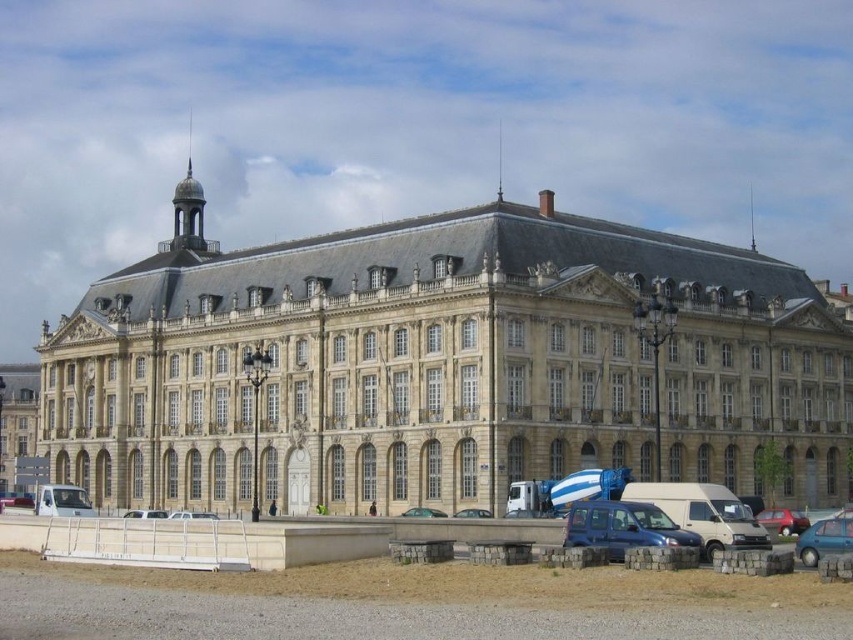
Question: Which point is farther to the camera?

Choices:
 (A) metallic blue hatchback at lower right
 (B) white matte van at lower left
 (C) white matte van at center
 (D) metallic blue car at center

Answer: (B)

Question: Is metallic blue van at lower center wider than metallic blue car at center?

Choices:
 (A) no
 (B) yes

Answer: (A)

Question: Which of the following is the closest to the observer?

Choices:
 (A) (158, 515)
 (B) (0, 493)

Answer: (A)

Question: Can you confirm if metallic blue van at lower center is thinner than matte black car at center?

Choices:
 (A) yes
 (B) no

Answer: (A)

Question: Observing the image, what is the correct spatial positioning of beige stone building at center in reference to metallic blue van at lower center?

Choices:
 (A) above
 (B) below

Answer: (A)

Question: Estimate the real-world distances between objects in this image. Which object is closer to the white matte van at center?

Choices:
 (A) white matte van at lower left
 (B) matte black sedan at center
 (C) silver metallic car at center
 (D) beige stone building at center

Answer: (C)